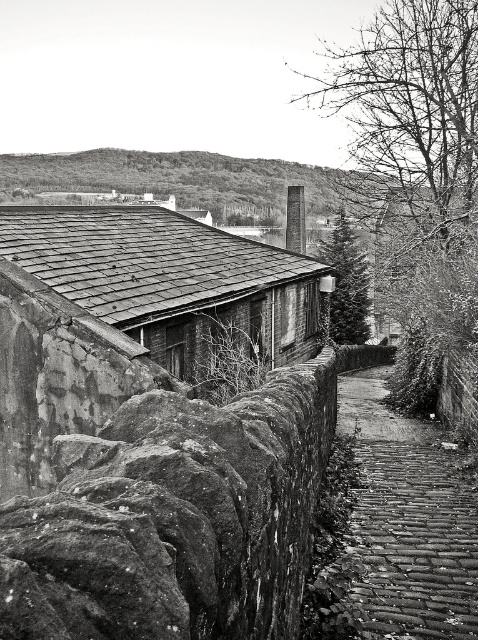
How much distance is there between bare branches at upper right and green textured pine tree at center?

bare branches at upper right and green textured pine tree at center are 5.16 meters apart.

What are the coordinates of `bare branches at upper right` in the screenshot? It's located at (409, 122).

Is point (323, 403) in front of point (43, 289)?

That is True.

Image resolution: width=478 pixels, height=640 pixels. What do you see at coordinates (174, 518) in the screenshot?
I see `rough stone wall at lower left` at bounding box center [174, 518].

The width and height of the screenshot is (478, 640). In order to click on rough stone wall at lower left in this screenshot , I will do `click(174, 518)`.

Is point (419, 237) closer to viewer compared to point (412, 496)?

No, it is behind (412, 496).

The width and height of the screenshot is (478, 640). What do you see at coordinates (409, 122) in the screenshot?
I see `bare branches at upper right` at bounding box center [409, 122].

Find the location of a particular element. This screenshot has width=478, height=640. bare branches at upper right is located at coordinates (x=409, y=122).